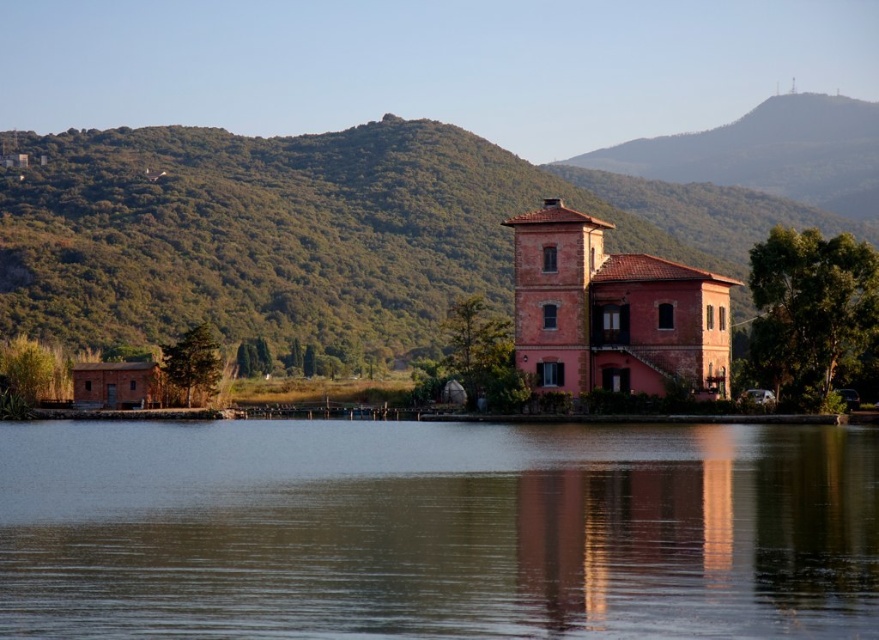
Question: Which of these objects is positioned closest to the green textured hillside at upper left?

Choices:
 (A) smooth water at center
 (B) matte brick house at center

Answer: (B)

Question: Which point appears closest to the camera in this image?

Choices:
 (A) (102, 618)
 (B) (636, 253)
 (C) (727, 202)

Answer: (A)

Question: Does smooth water at center appear over matte brick house at center?

Choices:
 (A) no
 (B) yes

Answer: (A)

Question: Can you confirm if smooth water at center is positioned to the left of matte brick house at center?

Choices:
 (A) no
 (B) yes

Answer: (B)

Question: Can you confirm if smooth water at center is wider than green textured hillside at upper left?

Choices:
 (A) yes
 (B) no

Answer: (B)

Question: Which point appears farthest from the camera in this image?

Choices:
 (A) (568, 273)
 (B) (591, 512)

Answer: (A)